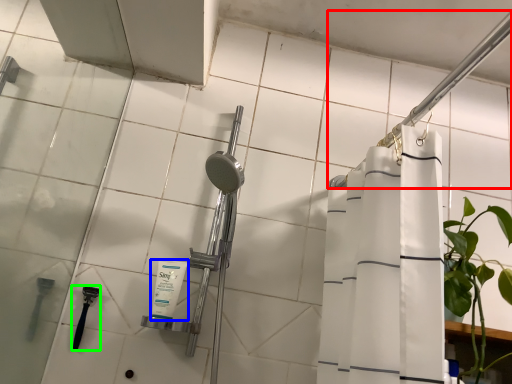
Question: Based on their relative distances, which object is nearer to shower (highlighted by a red box)? Choose from toiletry (highlighted by a blue box) and shower (highlighted by a green box).

Choices:
 (A) toiletry
 (B) shower

Answer: (A)